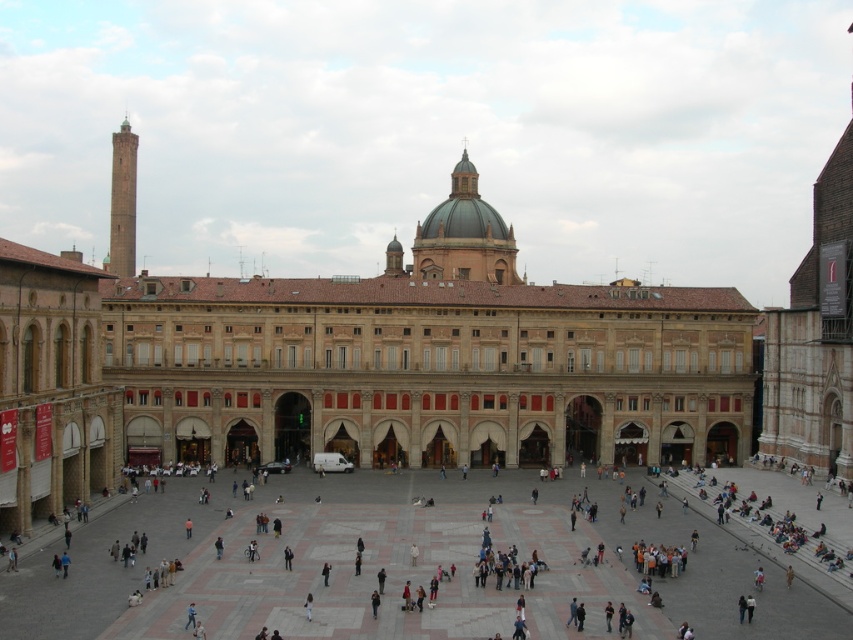
Can you confirm if brown stone building at center is thinner than marble tiles at center?

In fact, brown stone building at center might be wider than marble tiles at center.

Can you confirm if brown stone building at center is positioned above marble tiles at center?

Yes, brown stone building at center is above marble tiles at center.

The image size is (853, 640). I want to click on brown stone building at center, so click(422, 356).

Locate an element on the screen. The height and width of the screenshot is (640, 853). brown stone building at center is located at coordinates (422, 356).